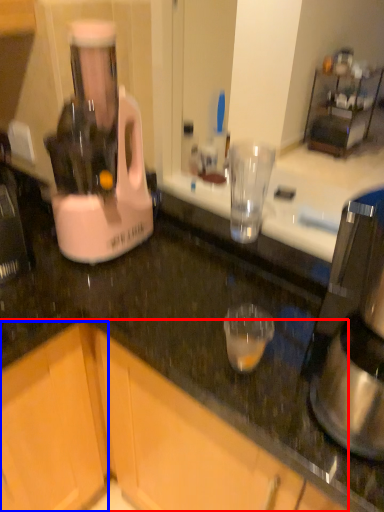
Question: Which of the following is the farthest to the observer, cabinetry (highlighted by a red box) or cabinetry (highlighted by a blue box)?

Choices:
 (A) cabinetry
 (B) cabinetry

Answer: (B)